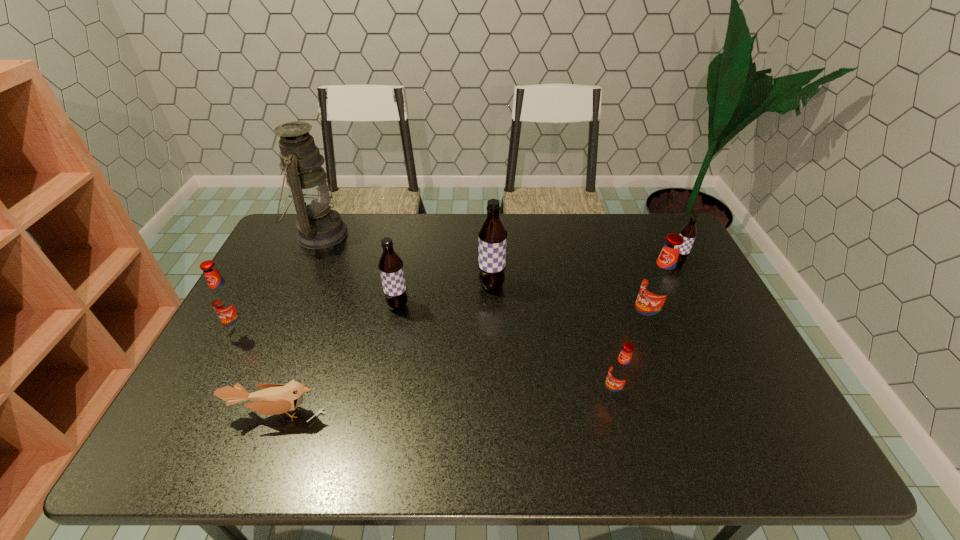
In order to click on free point at the far edge in this screenshot , I will do `click(614, 236)`.

Locate an element on the screen. This screenshot has width=960, height=540. vacant area at the near edge of the desktop is located at coordinates (415, 435).

Where is `vacant position at the left edge of the desktop`? vacant position at the left edge of the desktop is located at coordinates (267, 336).

Identify the location of vacant space at the right edge of the desktop. (718, 332).

Identify the location of blank space at the near right corner. (785, 460).

The height and width of the screenshot is (540, 960). In order to click on vacant point located between the fourth object from right to left and the rightmost brown root beer in this screenshot , I will do `click(585, 274)`.

Find the location of a particular element. vacant region between the oil lamp and the shortest object is located at coordinates (299, 324).

You are a GUI agent. You are given a task and a screenshot of the screen. Output one action in this format:
    pyautogui.click(x=<x>, y=<y>)
    Task: Click on the vacant point located between the smallest brown root beer and the second biggest red root beer
    
    Given the screenshot: What is the action you would take?
    pyautogui.click(x=459, y=296)

What are the coordinates of `free spot between the tallest object and the shortest object` in the screenshot? It's located at (299, 324).

Image resolution: width=960 pixels, height=540 pixels. What are the coordinates of `vacant area that lies between the rightmost root beer and the bird` in the screenshot? It's located at (477, 338).